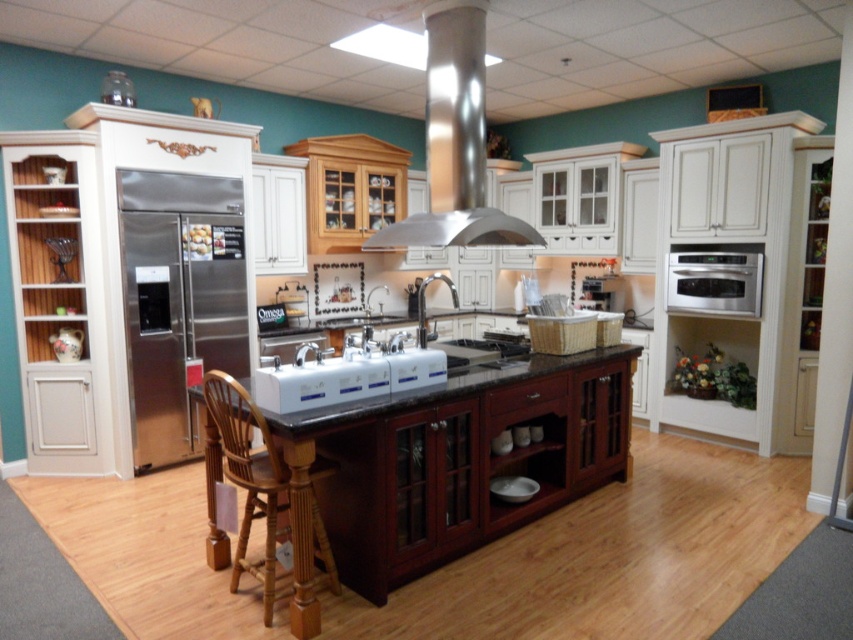
You are standing in the modern kitchen showroom and want to sit down. Where is the wooden chair at center located in relation to the stainless steel refrigerator on the left side?

The wooden chair at center is located to the right of the stainless steel refrigerator on the left side.